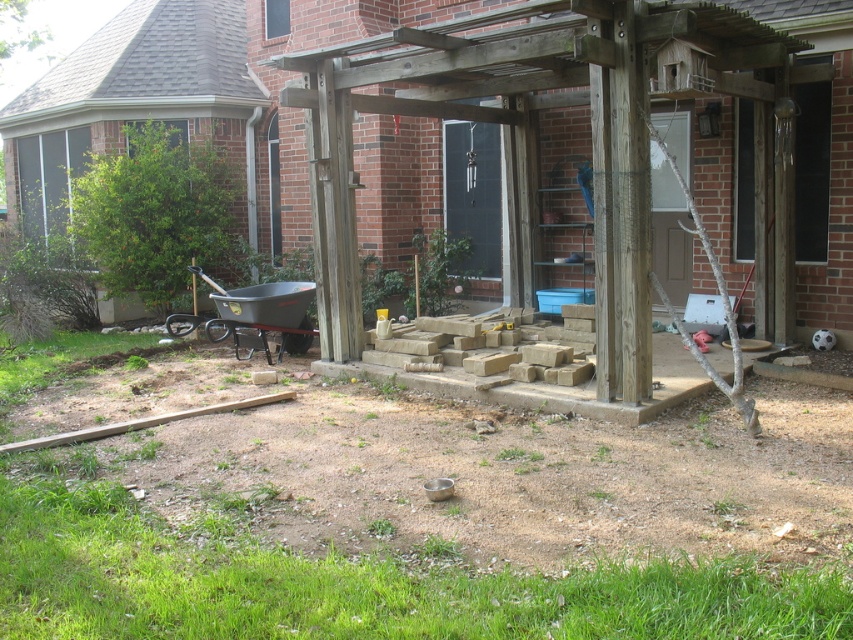
I want to click on wooden pergola at center, so click(x=537, y=145).

Who is more distant from viewer, (x=538, y=49) or (x=442, y=333)?

The point (x=442, y=333) is behind.

This screenshot has height=640, width=853. I want to click on wooden pergola at center, so click(537, 145).